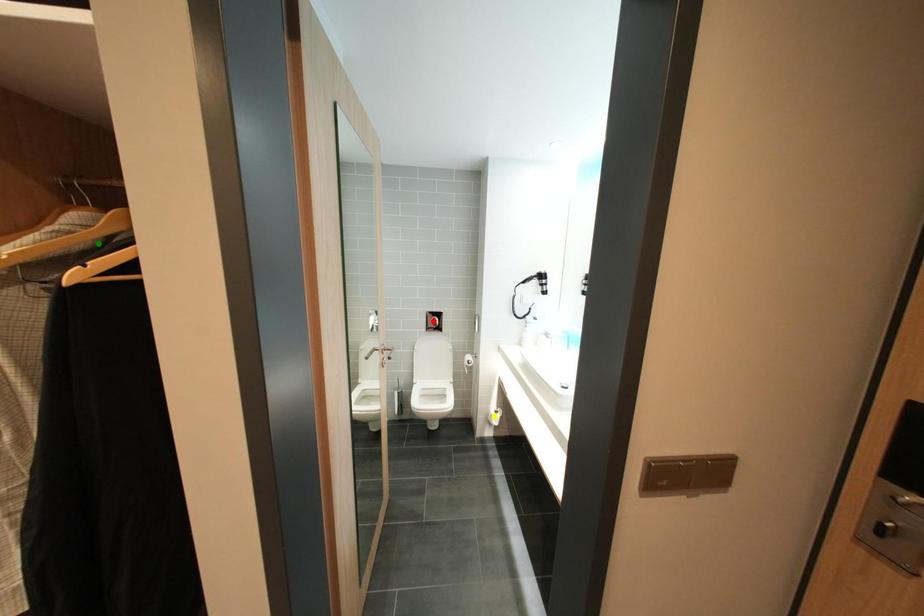
Order these from nearest to farthest:
- green point
- red point
- yellow point

green point
yellow point
red point